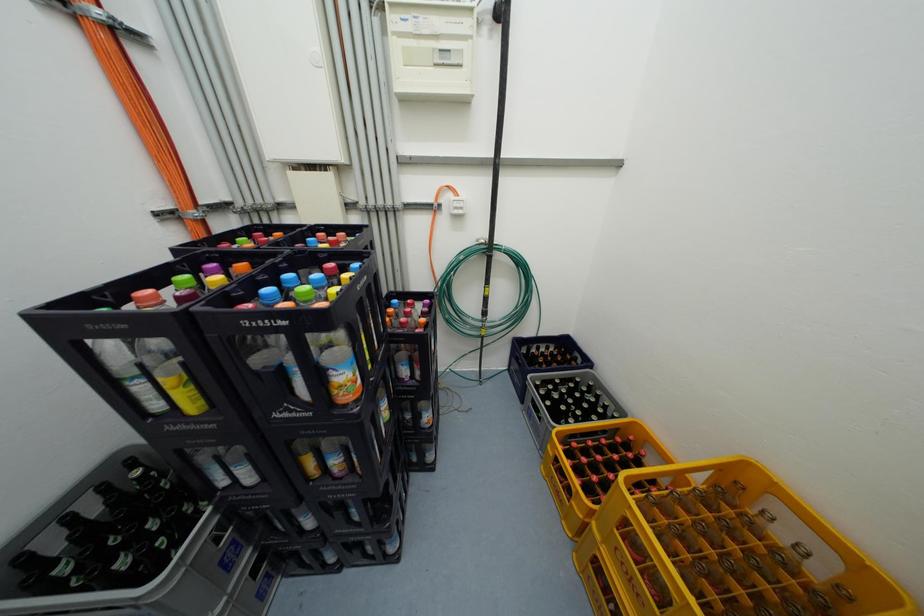
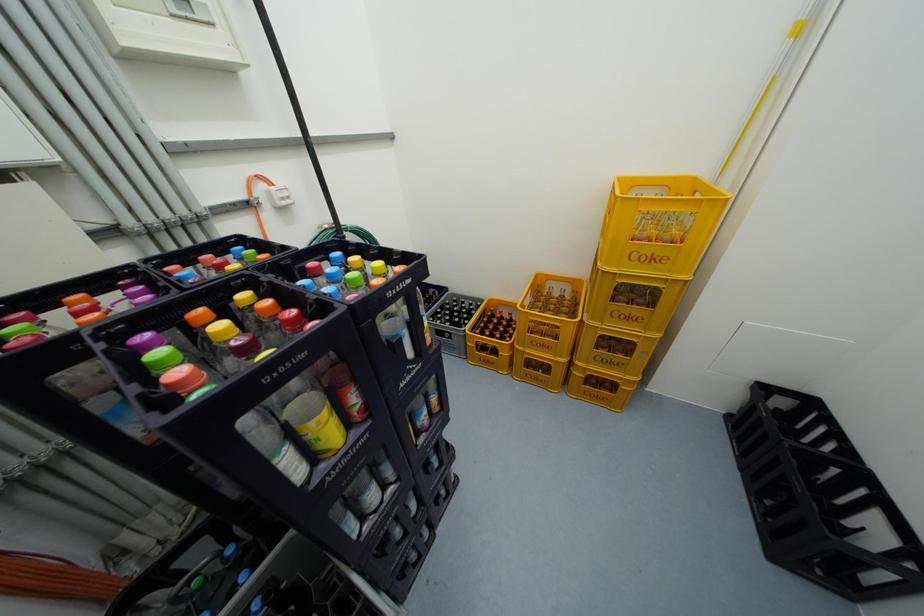
The images are taken continuously from a first-person perspective. In which direction is your viewpoint rotating?

The camera rotated toward right-down.